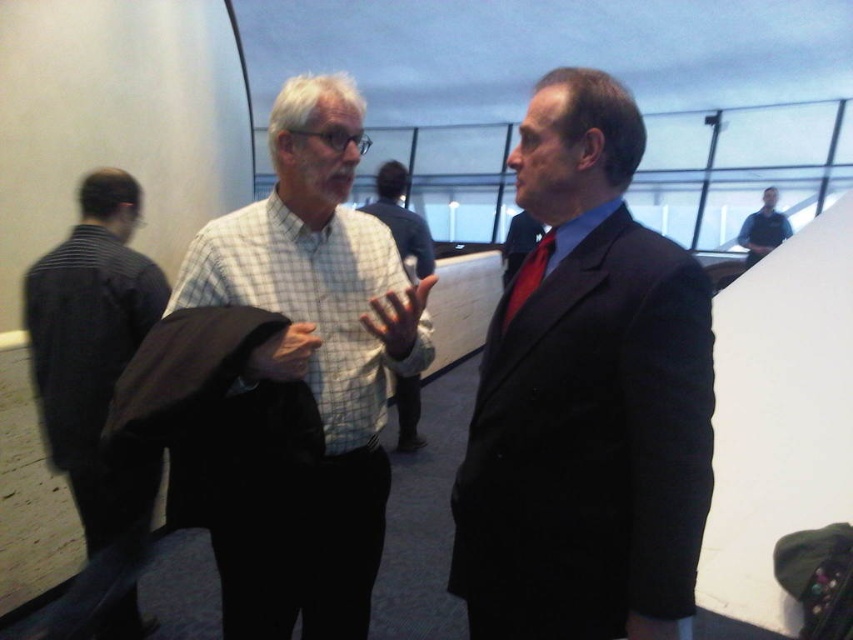
Does matte black suit at center lie behind white checkered shirt at center?

No, matte black suit at center is closer to the viewer.

Is point (706, 416) farther from viewer compared to point (364, 410)?

No, (706, 416) is in front of (364, 410).

Find the location of a particular element. matte black suit at center is located at coordinates (587, 401).

Is point (305, 90) in front of point (111, 282)?

Yes, it is in front of point (111, 282).

Does white checkered shirt at center have a greater height compared to striped fabric shirt at left?

Incorrect, white checkered shirt at center's height is not larger of striped fabric shirt at left's.

I want to click on white checkered shirt at center, so 311,369.

Does striped fabric shirt at left appear over dark blue shirt at upper right?

No, striped fabric shirt at left is not above dark blue shirt at upper right.

Looking at this image, is striped fabric shirt at left bigger than dark blue shirt at upper right?

Correct, striped fabric shirt at left is larger in size than dark blue shirt at upper right.

Is point (85, 179) closer to camera compared to point (759, 232)?

That is True.

Find the location of a particular element. The height and width of the screenshot is (640, 853). striped fabric shirt at left is located at coordinates coord(96,396).